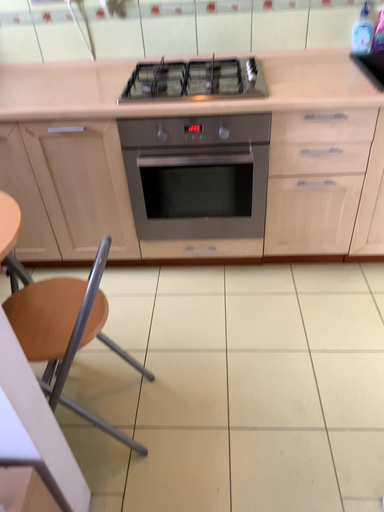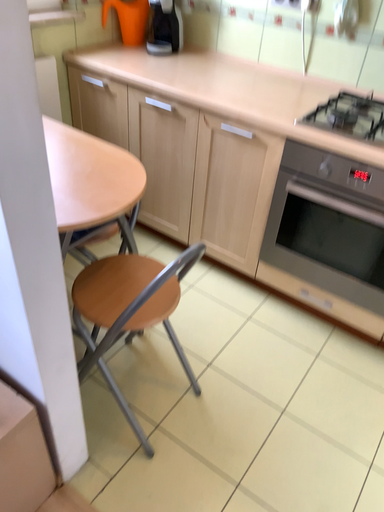
Question: How did the camera likely rotate when shooting the video?

Choices:
 (A) rotated left
 (B) rotated right

Answer: (A)